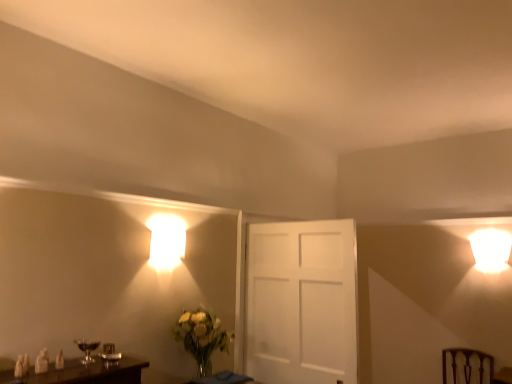
Question: Does matte glass wine glass at lower left lie behind translucent glass table at lower center?

Choices:
 (A) no
 (B) yes

Answer: (A)

Question: Is translucent glass table at lower center inside matte glass wine glass at lower left?

Choices:
 (A) no
 (B) yes

Answer: (A)

Question: From the image's perspective, is matte glass wine glass at lower left on translucent glass table at lower center?

Choices:
 (A) yes
 (B) no

Answer: (A)

Question: Does matte glass wine glass at lower left turn towards translucent glass table at lower center?

Choices:
 (A) yes
 (B) no

Answer: (B)

Question: Is matte glass wine glass at lower left positioned before translucent glass table at lower center?

Choices:
 (A) yes
 (B) no

Answer: (A)

Question: In the image, is translucent glass table at lower center positioned in front of or behind matte glass wine glass at lower left?

Choices:
 (A) front
 (B) behind

Answer: (B)

Question: From a real-world perspective, is translucent glass table at lower center physically located above or below matte glass wine glass at lower left?

Choices:
 (A) below
 (B) above

Answer: (A)

Question: Is translucent glass table at lower center to the left or to the right of matte glass wine glass at lower left in the image?

Choices:
 (A) left
 (B) right

Answer: (B)

Question: Is translucent glass table at lower center bigger or smaller than matte glass wine glass at lower left?

Choices:
 (A) small
 (B) big

Answer: (B)

Question: Is matte glass wine glass at lower left inside the boundaries of translucent glass table at lower center, or outside?

Choices:
 (A) outside
 (B) inside

Answer: (A)

Question: In terms of height, does matte glass wine glass at lower left look taller or shorter compared to translucent glass table at lower center?

Choices:
 (A) tall
 (B) short

Answer: (A)

Question: Looking at the image, does matte glass wine glass at lower left seem bigger or smaller compared to translucent glass table at lower center?

Choices:
 (A) small
 (B) big

Answer: (A)

Question: From the image's perspective, is matte glass wine glass at lower left located above or below translucent glass table at lower center?

Choices:
 (A) below
 (B) above

Answer: (B)

Question: In terms of size, does brown wooden swivel chair at lower right appear bigger or smaller than translucent glass table at lower center?

Choices:
 (A) small
 (B) big

Answer: (B)

Question: Is brown wooden swivel chair at lower right wider or thinner than translucent glass table at lower center?

Choices:
 (A) thin
 (B) wide

Answer: (B)